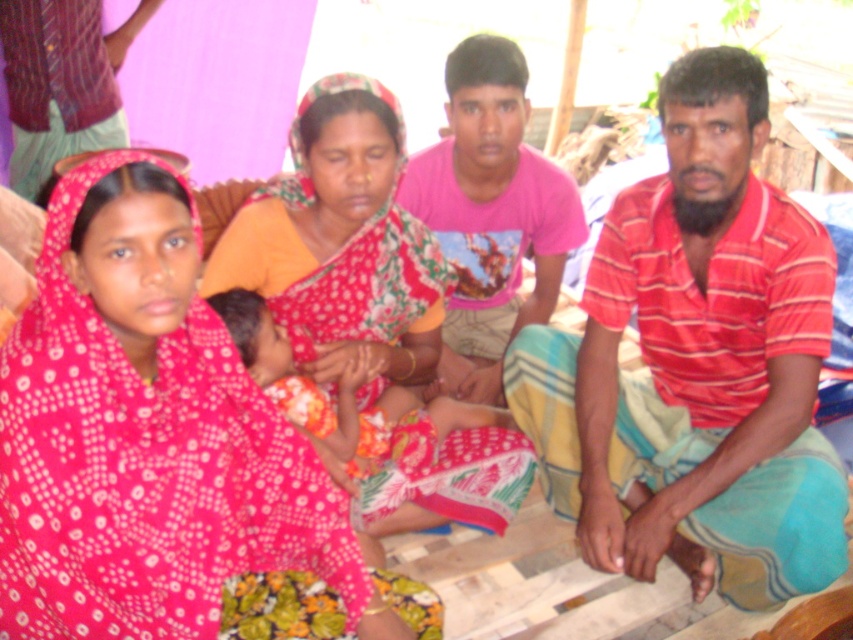
Is red striped shirt at center below pink cotton shirt at center?

Correct, red striped shirt at center is located below pink cotton shirt at center.

Which of these two, red striped shirt at center or pink cotton shirt at center, stands taller?

red striped shirt at center is taller.

At what (x,y) coordinates should I click in order to perform the action: click on red striped shirt at center. Please return your answer as a coordinate pair (x, y). This screenshot has width=853, height=640. Looking at the image, I should click on (695, 364).

Does polka dot fabric sari at center have a lesser height compared to pink cotton shirt at center?

Yes.

How much distance is there between polka dot fabric sari at center and pink cotton shirt at center?

polka dot fabric sari at center and pink cotton shirt at center are 1.10 meters apart.

Is point (271, 461) behind point (514, 221)?

That is False.

Locate an element on the screen. polka dot fabric sari at center is located at coordinates click(x=148, y=438).

Does polka dot fabric sari at center have a greater height compared to floral fabric sari at center?

In fact, polka dot fabric sari at center may be shorter than floral fabric sari at center.

How far apart are polka dot fabric sari at center and floral fabric sari at center?

53.12 centimeters

This screenshot has width=853, height=640. What are the coordinates of `polka dot fabric sari at center` in the screenshot? It's located at (148, 438).